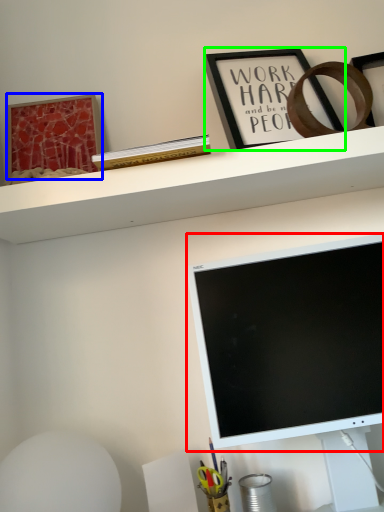
Question: Considering the real-world distances, which object is closest to computer monitor (highlighted by a red box)? picture frame (highlighted by a blue box) or picture frame (highlighted by a green box).

Choices:
 (A) picture frame
 (B) picture frame

Answer: (B)